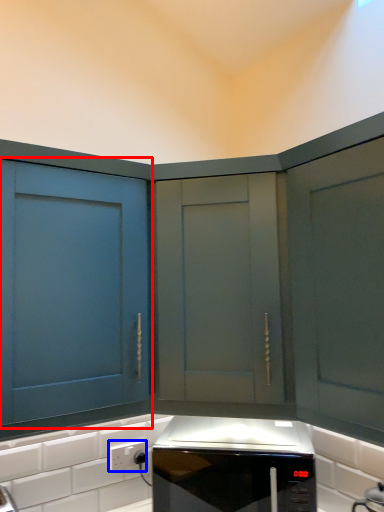
Question: Which point is further to the camera, cabinetry (highlighted by a red box) or electric outlet (highlighted by a blue box)?

Choices:
 (A) cabinetry
 (B) electric outlet

Answer: (B)